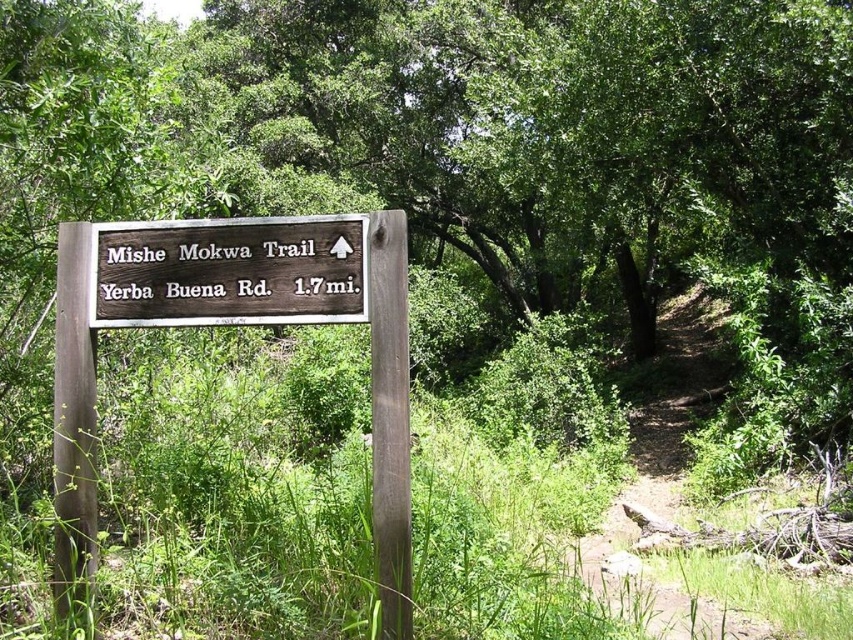
You are a hiker who wants to follow the Mishe Mokwa Trail. You see the brown wooden sign at center and the dirt path at center. Which one is smaller in size?

The brown wooden sign at center occupies less space than dirt path at center, so the brown wooden sign at center is smaller in size.

You are standing at the origin point of the coordinate system in the forest scene. The brown wooden sign at center is located at coordinates point 0.425, 0.270. If you want to reach the sign, in which direction should you move?

To reach the brown wooden sign at center located at coordinates point (x=229, y=272) from the origin, you should move northeast since the x and y coordinates are both positive.